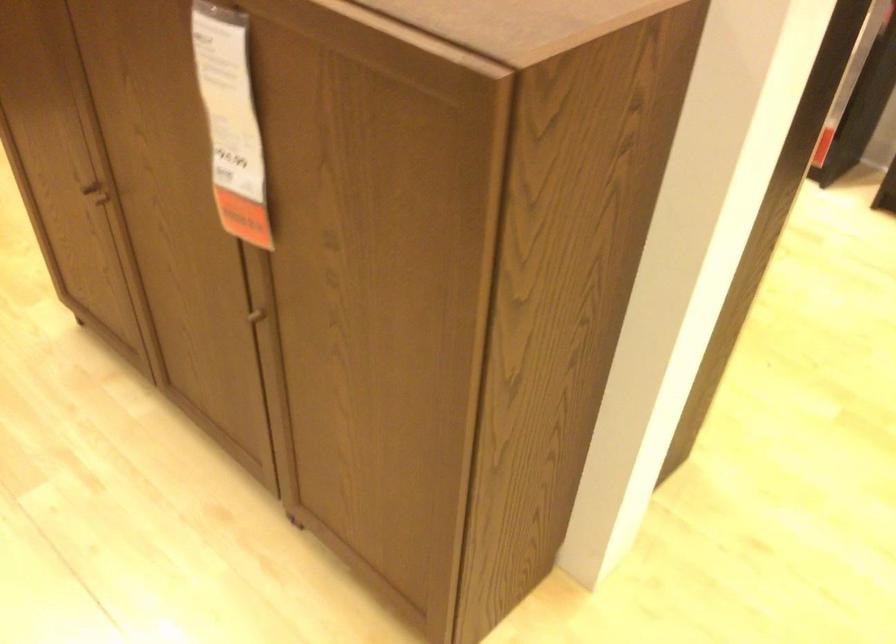
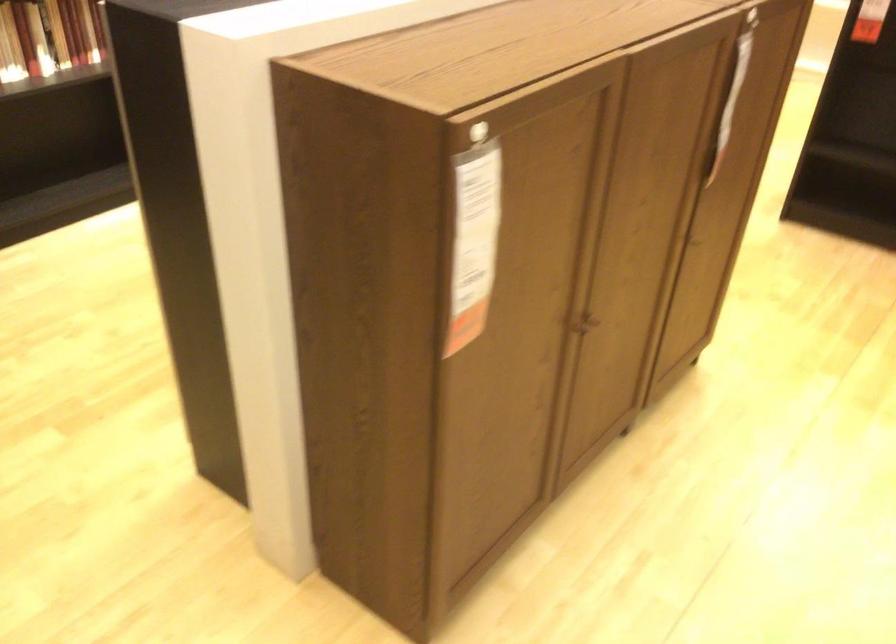
Where in the second image is the point corresponding to point 96,184 from the first image?

(583, 323)